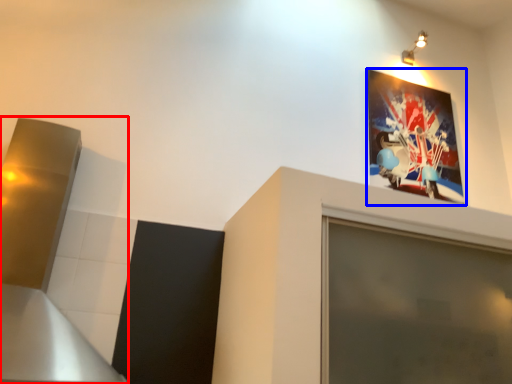
Question: Which point is closer to the camera, exhaust hood (highlighted by a red box) or picture frame (highlighted by a blue box)?

Choices:
 (A) exhaust hood
 (B) picture frame

Answer: (A)